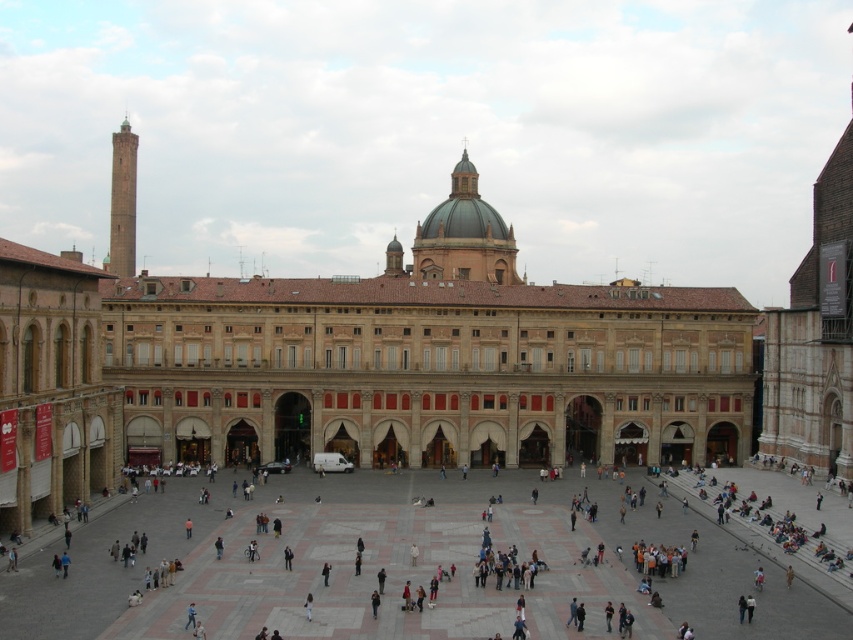
Consider the image. You are standing in the piazza and want to take a photo of the brown stone building at center. If your camera can focus on objects up to 300 feet away, will you need to move closer to get a clear shot?

The brown stone building at center is 324.51 feet away from the viewer, which is beyond the camera focus range of 300 feet. Therefore, you need to move closer to ensure the building is in focus.

In the scene shown: You are a tourist standing in the piazza and want to take a photo of the brown stone building at center without including the marble tiles at center in the frame. Is it possible to do so?

The brown stone building at center might be wider than marble tiles at center, so it depends on their actual widths. If the building is indeed wider, you could position yourself to frame it without the tiles. However, if they are similar in width, it might be challenging.

You are standing in the bustling piazza and want to take a photo of the brown stone building at center. Where should you position yourself to ensure the building is centered in your camera viewfinder?

The brown stone building at center is located at point coordinates approximately 0.558 on the x and 0.497 on the y axis. To center it in your camera viewfinder, position yourself directly facing the building at those coordinates.